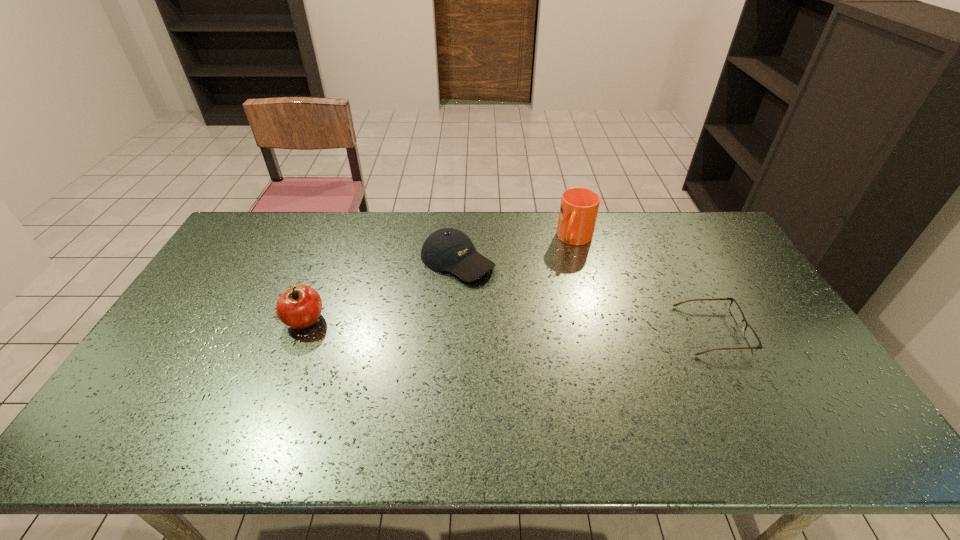
You are a GUI agent. You are given a task and a screenshot of the screen. Output one action in this format:
    pyautogui.click(x=<x>, y=<y>)
    Task: Click on the free space on the desktop that is between the leftmost object and the rightmost object and is positioned on the handle side of the tallest object
    The height and width of the screenshot is (540, 960).
    Given the screenshot: What is the action you would take?
    pyautogui.click(x=545, y=326)

This screenshot has height=540, width=960. In order to click on vacant space on the desktop that is between the third shortest object and the rightmost object and is positioned on the front-facing side of the baseball cap in this screenshot , I will do `click(562, 327)`.